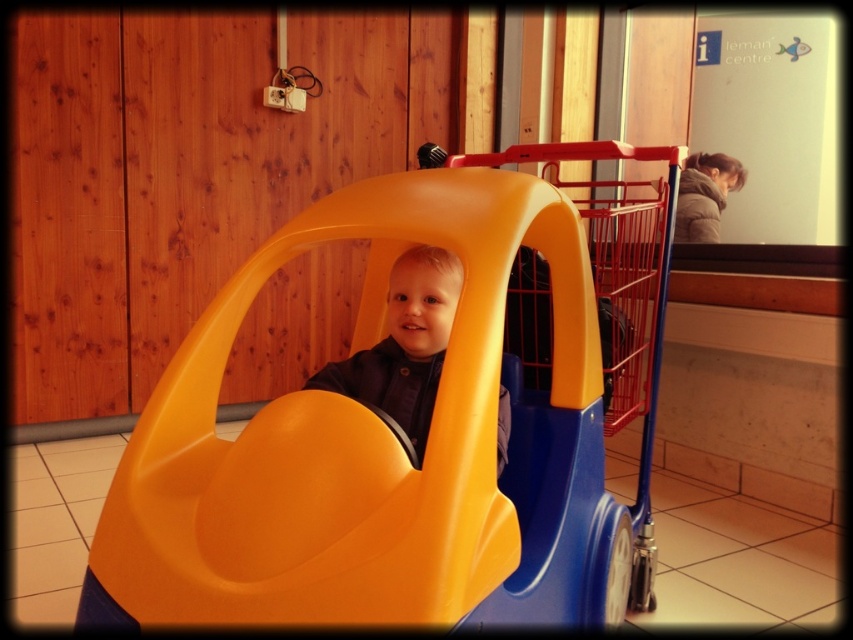
Question: Is matte plastic car at center to the left of yellow plastic toy car at center from the viewer's perspective?

Choices:
 (A) no
 (B) yes

Answer: (B)

Question: Which of the following is the closest to the observer?

Choices:
 (A) yellow plastic toy car at center
 (B) matte plastic boy at center
 (C) matte plastic car at center

Answer: (C)

Question: Which of the following is the closest to the observer?

Choices:
 (A) (378, 378)
 (B) (485, 269)

Answer: (B)

Question: Which object is closer to the camera taking this photo?

Choices:
 (A) matte plastic car at center
 (B) matte plastic boy at center

Answer: (A)

Question: Does matte plastic car at center have a lesser width compared to yellow plastic toy car at center?

Choices:
 (A) yes
 (B) no

Answer: (B)

Question: Does yellow plastic toy car at center have a larger size compared to matte plastic boy at center?

Choices:
 (A) yes
 (B) no

Answer: (A)